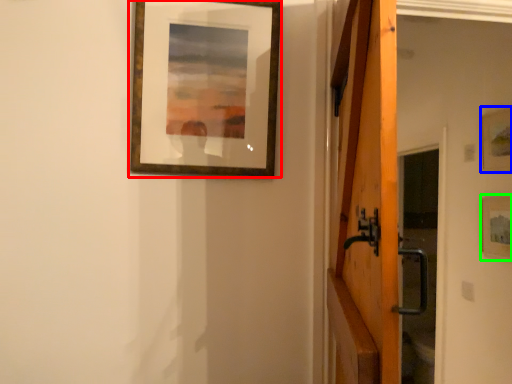
Question: Considering the real-world distances, which object is farthest from picture frame (highlighted by a red box)? picture frame (highlighted by a blue box) or picture frame (highlighted by a green box)?

Choices:
 (A) picture frame
 (B) picture frame

Answer: (B)